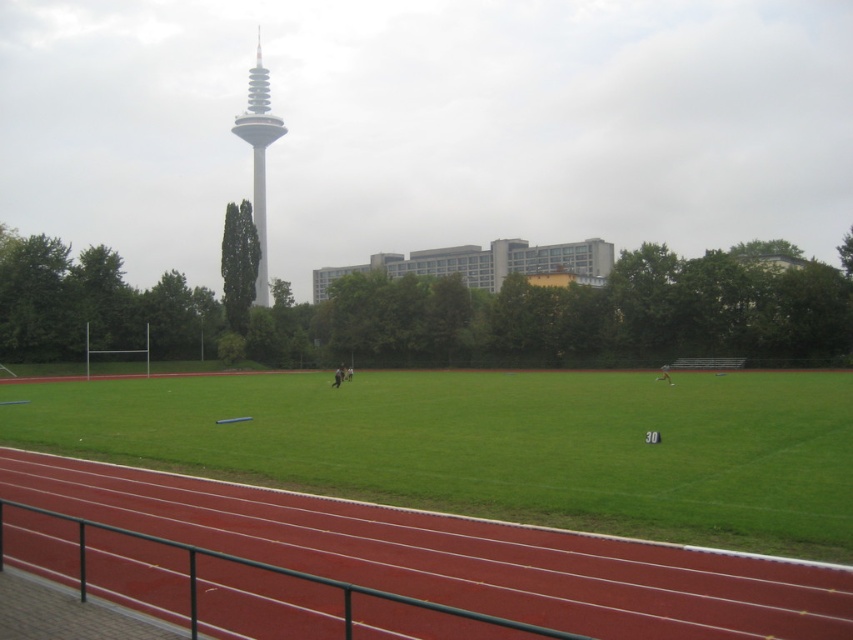
You are a runner preparing for a race and you see the green grass at center and the rubberized red track at lower left. Which surface should you choose to start your warmup to be closer to the starting line?

You should choose the rubberized red track at lower left because it is closer to the starting line than the green grass at center, which is further away.

You are a landscape architect planning to install a new walking path. You need to know the relative widths of the green grass at center and the rubberized red track at lower left to determine which area can accommodate a wider path. Which area is wider?

The green grass at center is wider than the rubberized red track at lower left, so the green grass at center can accommodate a wider path.